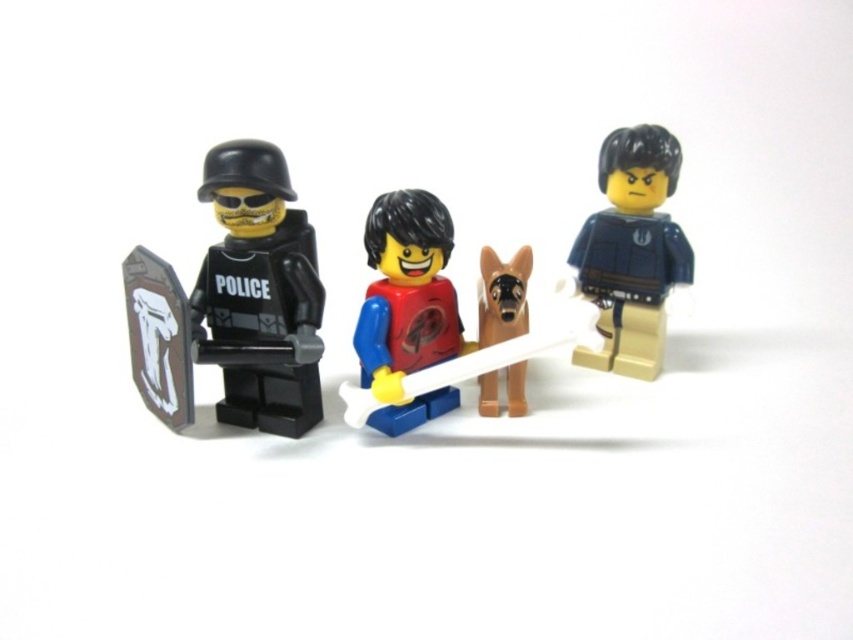
Question: Considering the relative positions of matte black police officer at left and smooth plastic figure at center in the image provided, where is matte black police officer at left located with respect to smooth plastic figure at center?

Choices:
 (A) below
 (B) above

Answer: (B)

Question: Does matte black police officer at left lie behind brown matte dog at center?

Choices:
 (A) no
 (B) yes

Answer: (A)

Question: Among these objects, which one is nearest to the camera?

Choices:
 (A) matte black police officer at left
 (B) smooth plastic figure at center
 (C) brown matte dog at center

Answer: (A)

Question: Is matte black police officer at left positioned in front of brown matte dog at center?

Choices:
 (A) yes
 (B) no

Answer: (A)

Question: Which of these objects is positioned farthest from the matte black police officer at left?

Choices:
 (A) smooth plastic figure at center
 (B) blue matte shirt at center
 (C) brown matte dog at center

Answer: (B)

Question: Which object is the closest to the blue matte shirt at center?

Choices:
 (A) smooth plastic figure at center
 (B) brown matte dog at center

Answer: (B)